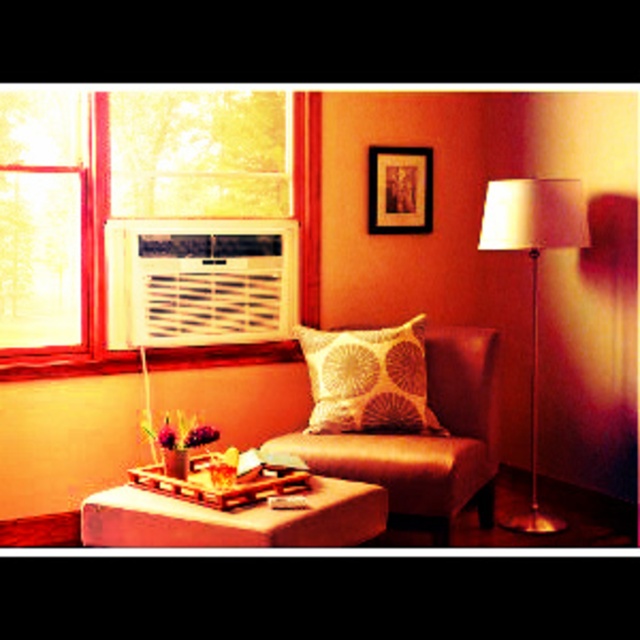
Question: Can you confirm if satin beige armchair at center is positioned above metallic gold floor lamp at right?

Choices:
 (A) yes
 (B) no

Answer: (B)

Question: Which object is the closest to the satin beige armchair at center?

Choices:
 (A) wooden tray at lower center
 (B) metallic gold floor lamp at right

Answer: (B)

Question: Does white plastic air conditioner at upper left appear under metallic gold floor lamp at right?

Choices:
 (A) yes
 (B) no

Answer: (B)

Question: Can you confirm if satin beige armchair at center is positioned above metallic gold floor lamp at right?

Choices:
 (A) yes
 (B) no

Answer: (B)

Question: Which of these objects is positioned farthest from the metallic gold floor lamp at right?

Choices:
 (A) white textured pillow at center
 (B) white plastic air conditioner at upper left
 (C) wooden tray at lower center
 (D) satin beige armchair at center

Answer: (C)

Question: Which object is the closest to the white textured pillow at center?

Choices:
 (A) satin beige armchair at center
 (B) metallic gold floor lamp at right
 (C) wooden tray at lower center

Answer: (A)